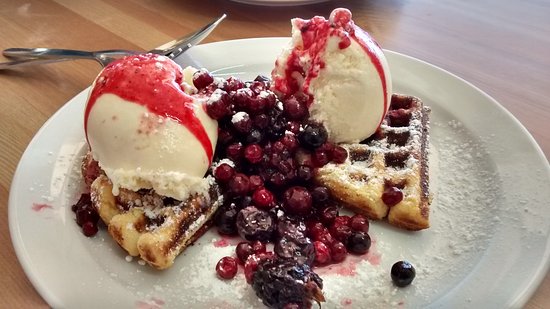
You are a GUI agent. You are given a task and a screenshot of the screen. Output one action in this format:
    pyautogui.click(x=<x>, y=<y>)
    Task: Click on the white plate
    
    Given the screenshot: What is the action you would take?
    pyautogui.click(x=515, y=268)